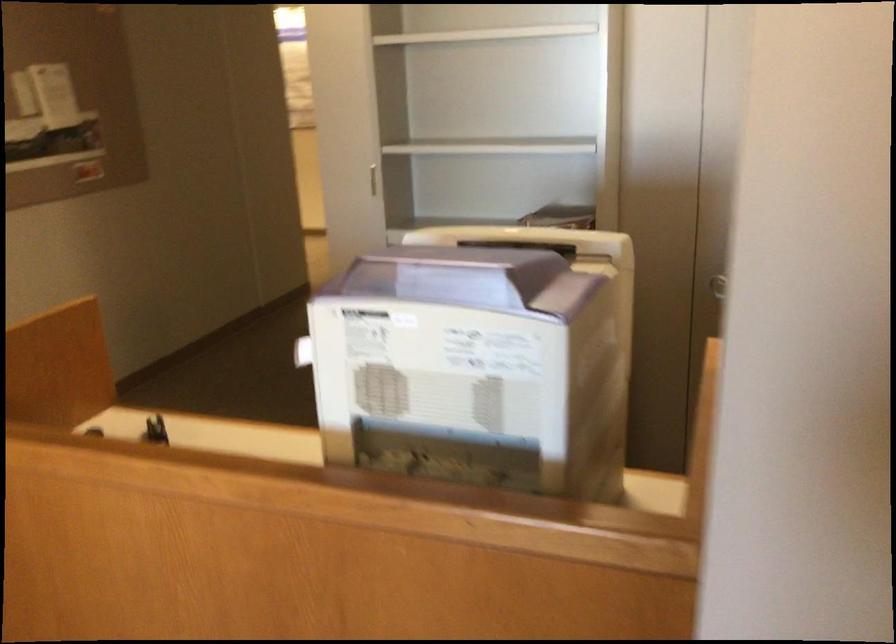
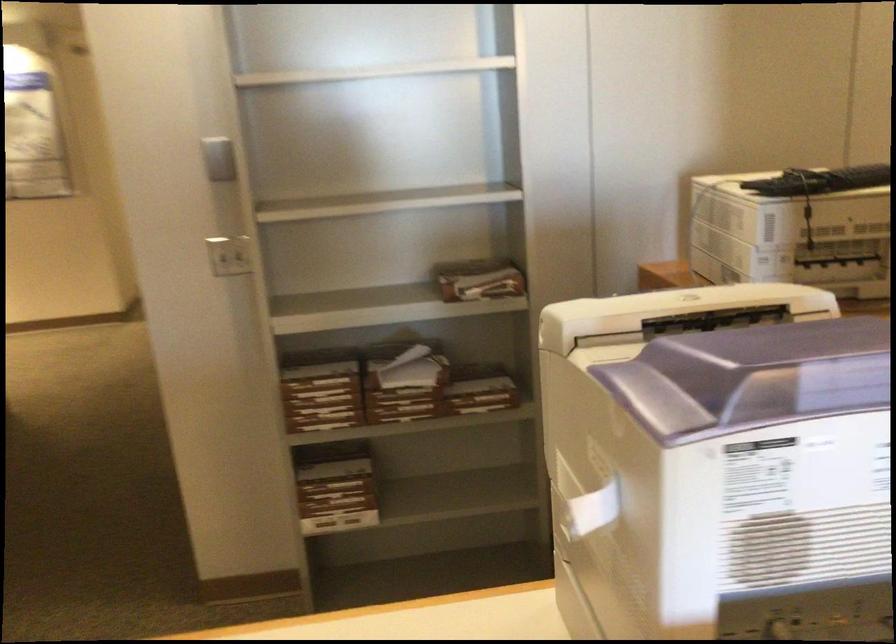
Locate, in the second image, the point that corresponds to (319,345) in the first image.

(592, 507)